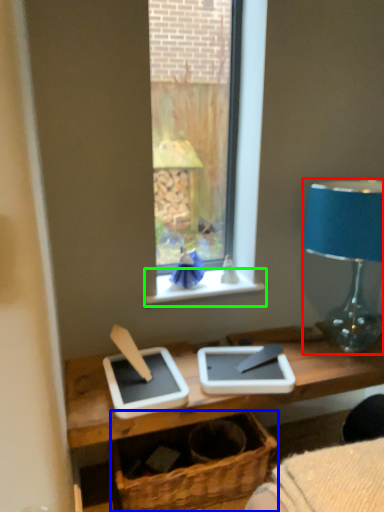
Question: Which object is positioned closest to lamp (highlighted by a red box)? Select from basket (highlighted by a blue box) and window sill (highlighted by a green box).

Choices:
 (A) basket
 (B) window sill

Answer: (B)